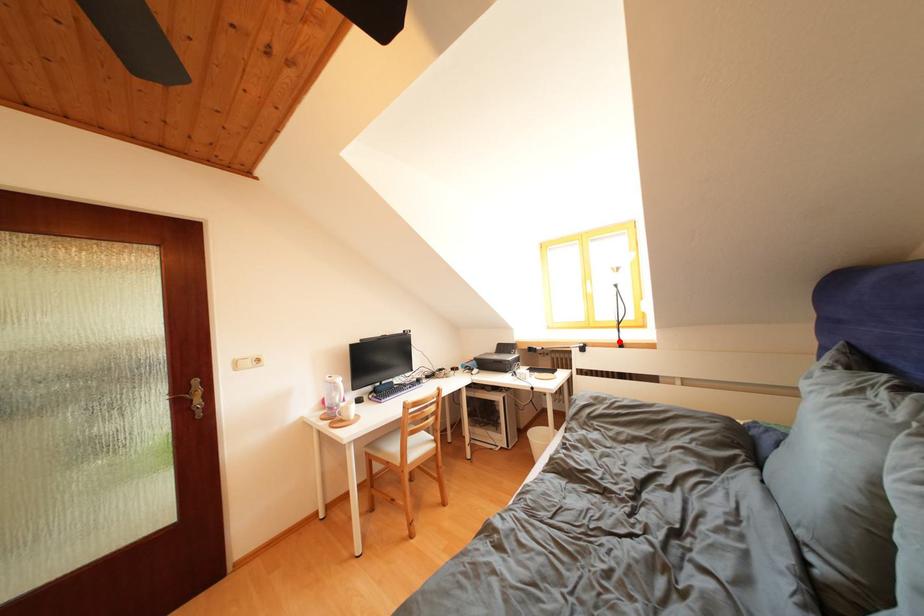
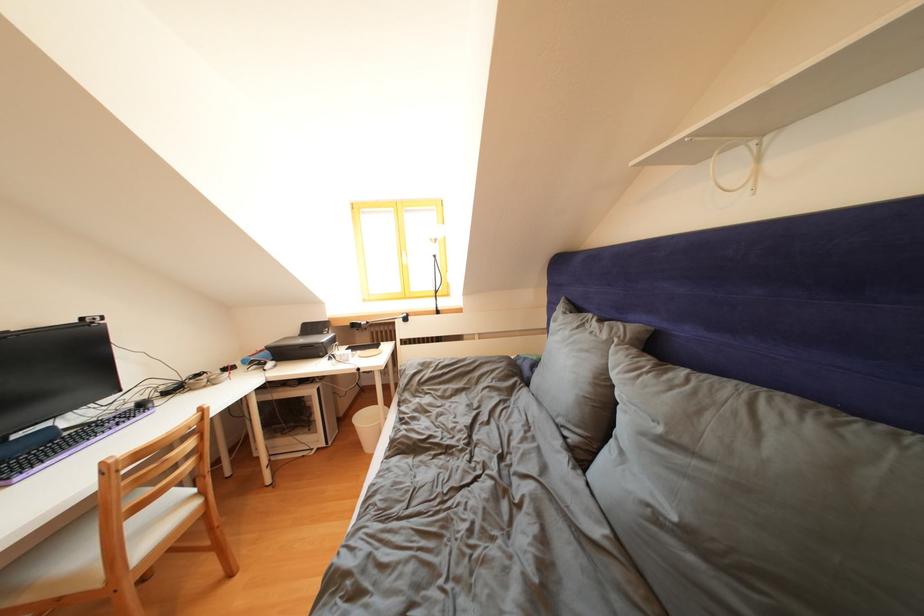
The point at the highlighted location is marked in the first image. Where is the corresponding point in the second image?

(438, 310)